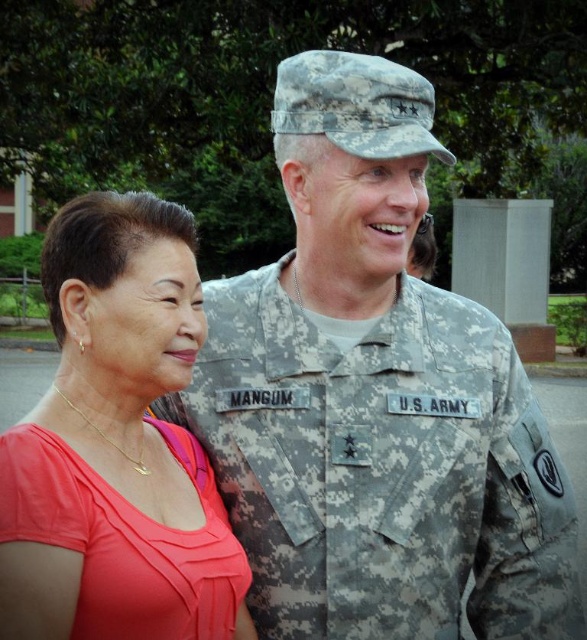
Question: Considering the real-world distances, which object is farthest from the matte coral blouse at left?

Choices:
 (A) camouflage fabric uniform at center
 (B) camouflage uniform at center

Answer: (B)

Question: Among these points, which one is nearest to the camera?

Choices:
 (A) (136, 560)
 (B) (286, 83)

Answer: (A)

Question: Which is farther from the camouflage uniform at center?

Choices:
 (A) matte coral blouse at left
 (B) camouflage fabric uniform at center

Answer: (A)

Question: Is camouflage uniform at center wider than matte coral blouse at left?

Choices:
 (A) yes
 (B) no

Answer: (A)

Question: Does camouflage uniform at center appear on the right side of matte coral blouse at left?

Choices:
 (A) yes
 (B) no

Answer: (A)

Question: Is camouflage uniform at center to the right of matte coral blouse at left from the viewer's perspective?

Choices:
 (A) yes
 (B) no

Answer: (A)